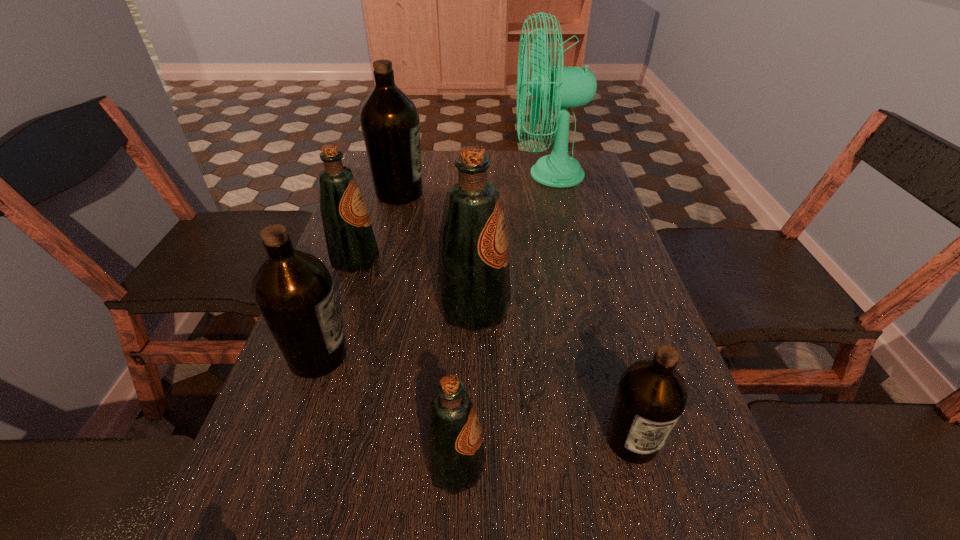
Choose which brown olive oil is the third nearest neighbor to the biggest green olive oil. Please provide its 2D coordinates. Your answer should be formatted as a tuple, i.e. [(x, y)], where the tuple contains the x and y coordinates of a point satisfying the conditions above.

[(389, 120)]

Find the location of a particular element. brown olive oil that is the closest to the second biggest brown olive oil is located at coordinates (652, 395).